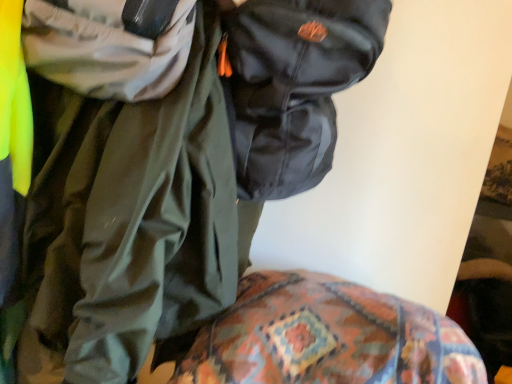
Question: Is shiny black jacket at upper center oriented towards patterned fabric at lower center?

Choices:
 (A) yes
 (B) no

Answer: (B)

Question: From a real-world perspective, is shiny black jacket at upper center beneath patterned fabric at lower center?

Choices:
 (A) no
 (B) yes

Answer: (A)

Question: Does shiny black jacket at upper center have a greater width compared to patterned fabric at lower center?

Choices:
 (A) no
 (B) yes

Answer: (A)

Question: From the image's perspective, would you say shiny black jacket at upper center is positioned over patterned fabric at lower center?

Choices:
 (A) no
 (B) yes

Answer: (B)

Question: Is shiny black jacket at upper center behind patterned fabric at lower center?

Choices:
 (A) no
 (B) yes

Answer: (A)

Question: Considering the relative positions of patterned fabric at lower center and glossy black backpack at upper center in the image provided, is patterned fabric at lower center to the left or to the right of glossy black backpack at upper center?

Choices:
 (A) right
 (B) left

Answer: (A)

Question: From a real-world perspective, is patterned fabric at lower center above or below glossy black backpack at upper center?

Choices:
 (A) above
 (B) below

Answer: (B)

Question: Considering the positions of point click(330, 367) and point click(237, 97), is point click(330, 367) closer or farther from the camera than point click(237, 97)?

Choices:
 (A) farther
 (B) closer

Answer: (B)

Question: From the image's perspective, is patterned fabric at lower center positioned above or below glossy black backpack at upper center?

Choices:
 (A) below
 (B) above

Answer: (A)

Question: From the image's perspective, is glossy black backpack at upper center located above or below shiny black jacket at upper center?

Choices:
 (A) above
 (B) below

Answer: (A)

Question: Looking at their shapes, would you say glossy black backpack at upper center is wider or thinner than shiny black jacket at upper center?

Choices:
 (A) wide
 (B) thin

Answer: (B)

Question: From a real-world perspective, relative to shiny black jacket at upper center, is glossy black backpack at upper center vertically above or below?

Choices:
 (A) above
 (B) below

Answer: (A)

Question: In the image, is glossy black backpack at upper center on the left side or the right side of shiny black jacket at upper center?

Choices:
 (A) left
 (B) right

Answer: (B)

Question: Is patterned fabric at lower center inside or outside of shiny black jacket at upper center?

Choices:
 (A) inside
 (B) outside

Answer: (B)

Question: From the image's perspective, relative to shiny black jacket at upper center, is patterned fabric at lower center above or below?

Choices:
 (A) below
 (B) above

Answer: (A)